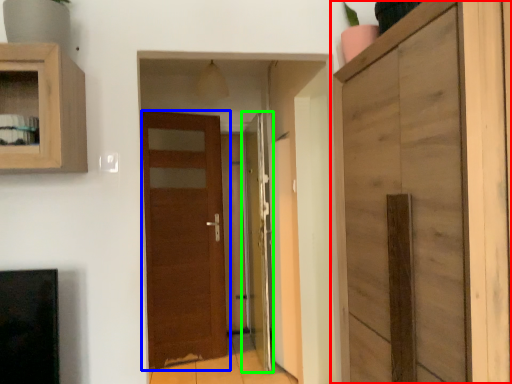
Question: Considering the real-world distances, which object is closest to cupboard (highlighted by a red box)? door (highlighted by a blue box) or door (highlighted by a green box).

Choices:
 (A) door
 (B) door

Answer: (B)